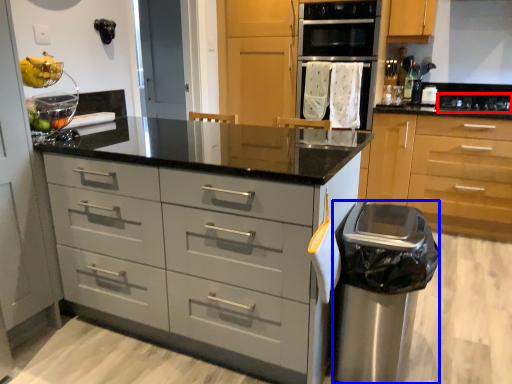
Question: Which of the following is the farthest to the observer, gas stove (highlighted by a red box) or garbage (highlighted by a blue box)?

Choices:
 (A) gas stove
 (B) garbage

Answer: (A)